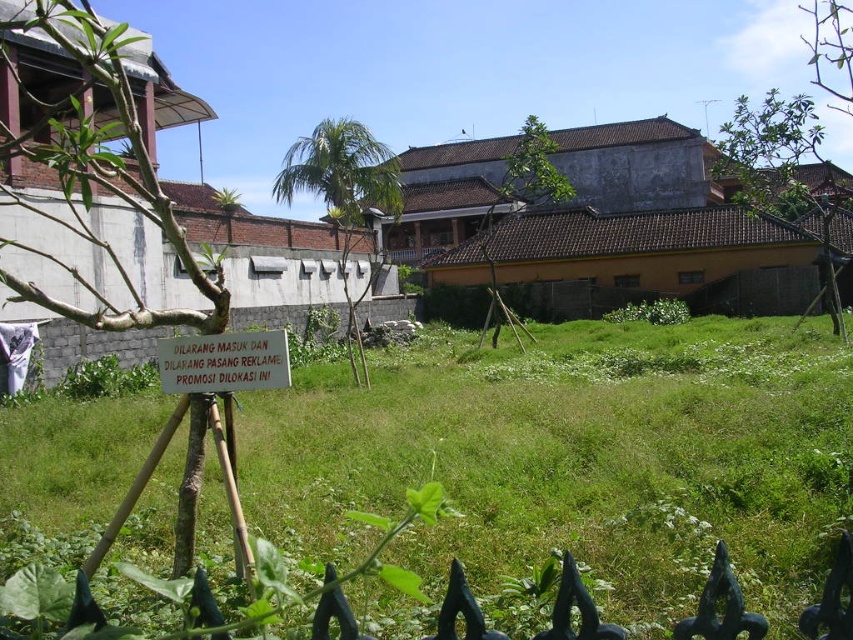
You are a delivery person trying to place a package on the ground. You see the green grassy at center and the white paper sign at center. Which object is closer to you where you can place the package?

The green grassy at center is in front of the white paper sign at center, so the green grassy at center is closer to you and suitable for placing the package.

You are a gardener who needs to mow the lawn. You see the green grassy at center and the white paper sign at center. Which area requires mowing first based on their height?

The green grassy at center is much taller than the white paper sign at center, so the gardener should mow the green grassy at center first to maintain the area.